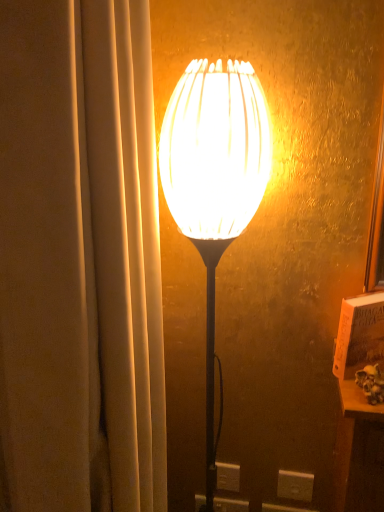
Image resolution: width=384 pixels, height=512 pixels. Find the location of `white plastic electric outlet at lower center`. white plastic electric outlet at lower center is located at coordinates (295, 486).

What do you see at coordinates (295, 486) in the screenshot?
I see `white plastic electric outlet at lower center` at bounding box center [295, 486].

What is the approximate height of white plastic electric outlet at lower center?

white plastic electric outlet at lower center is 8.96 centimeters in height.

Where is `white matte lampshade at center`? white matte lampshade at center is located at coordinates click(214, 178).

What do you see at coordinates (214, 178) in the screenshot? The image size is (384, 512). I see `white matte lampshade at center` at bounding box center [214, 178].

The height and width of the screenshot is (512, 384). Find the location of `white plastic electric outlet at lower center`. white plastic electric outlet at lower center is located at coordinates (295, 486).

Does white plastic electric outlet at lower center appear on the right side of white matte lampshade at center?

Yes.

Does white plastic electric outlet at lower center come in front of white matte lampshade at center?

No, white plastic electric outlet at lower center is further to the viewer.

Is point (303, 483) behind point (177, 211)?

Yes.

From the image's perspective, is white plastic electric outlet at lower center located above white matte lampshade at center?

No.

From a real-world perspective, which is physically above, white plastic electric outlet at lower center or white matte lampshade at center?

From a 3D spatial view, white matte lampshade at center is above.

Is white plastic electric outlet at lower center wider than white matte lampshade at center?

No, white plastic electric outlet at lower center is not wider than white matte lampshade at center.

Considering the relative sizes of white plastic electric outlet at lower center and white matte lampshade at center in the image provided, is white plastic electric outlet at lower center shorter than white matte lampshade at center?

Yes, white plastic electric outlet at lower center is shorter than white matte lampshade at center.

Based on the photo, is white plastic electric outlet at lower center smaller than white matte lampshade at center?

Correct, white plastic electric outlet at lower center occupies less space than white matte lampshade at center.

Is white plastic electric outlet at lower center spatially inside white matte lampshade at center, or outside of it?

white plastic electric outlet at lower center is located beyond the bounds of white matte lampshade at center.

Is white plastic electric outlet at lower center in contact with white matte lampshade at center?

No, white plastic electric outlet at lower center is not in contact with white matte lampshade at center.

Could you tell me if white plastic electric outlet at lower center is turned towards white matte lampshade at center?

No, white plastic electric outlet at lower center is not turned towards white matte lampshade at center.

How different are the orientations of white plastic electric outlet at lower center and white matte lampshade at center in degrees?

There is a 41.3-degree angle between the facing directions of white plastic electric outlet at lower center and white matte lampshade at center.

How distant is white plastic electric outlet at lower center from white matte lampshade at center?

The distance of white plastic electric outlet at lower center from white matte lampshade at center is 24.02 inches.

Where is `lamp above the white plastic electric outlet at lower center (from a real-world perspective)`? The height and width of the screenshot is (512, 384). lamp above the white plastic electric outlet at lower center (from a real-world perspective) is located at coordinates (214, 178).

Based on their positions, is white matte lampshade at center located to the left or right of white plastic electric outlet at lower center?

In the image, white matte lampshade at center appears on the left side of white plastic electric outlet at lower center.

Is white matte lampshade at center in front of white plastic electric outlet at lower center?

Yes, white matte lampshade at center is closer to the viewer.

Does point (264, 191) appear closer or farther from the camera than point (299, 500)?

Point (264, 191) is closer to the camera than point (299, 500).

Looking at this image, from the image's perspective, is white matte lampshade at center over white plastic electric outlet at lower center?

Yes, from the image's perspective, white matte lampshade at center is on top of white plastic electric outlet at lower center.

From a real-world perspective, is white matte lampshade at center physically below white plastic electric outlet at lower center?

Actually, white matte lampshade at center is physically above white plastic electric outlet at lower center in the real world.

Between white matte lampshade at center and white plastic electric outlet at lower center, which one has larger width?

white matte lampshade at center.

Can you confirm if white matte lampshade at center is shorter than white plastic electric outlet at lower center?

In fact, white matte lampshade at center may be taller than white plastic electric outlet at lower center.

Can you confirm if white matte lampshade at center is smaller than white plastic electric outlet at lower center?

No, white matte lampshade at center is not smaller than white plastic electric outlet at lower center.

Is white matte lampshade at center surrounding white plastic electric outlet at lower center?

No, white plastic electric outlet at lower center is not a part of white matte lampshade at center.

Is white matte lampshade at center in contact with white plastic electric outlet at lower center?

white matte lampshade at center and white plastic electric outlet at lower center are clearly separated.

Is white matte lampshade at center turned away from white plastic electric outlet at lower center?

white matte lampshade at center is not turned away from white plastic electric outlet at lower center.

Identify the location of lamp above the white plastic electric outlet at lower center (from a real-world perspective). (214, 178).

Locate an element on the screen. electric outlet below the white matte lampshade at center (from the image's perspective) is located at coordinates (295, 486).

You are a GUI agent. You are given a task and a screenshot of the screen. Output one action in this format:
    pyautogui.click(x=<x>, y=<y>)
    Task: Click on the electric outlet located underneath the white matte lampshade at center (from a real-world perspective)
    Image resolution: width=384 pixels, height=512 pixels.
    Given the screenshot: What is the action you would take?
    pyautogui.click(x=295, y=486)